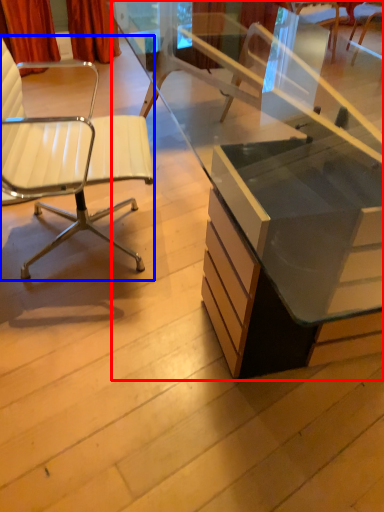
Question: Among these objects, which one is nearest to the camera, desk (highlighted by a red box) or chair (highlighted by a blue box)?

Choices:
 (A) desk
 (B) chair

Answer: (A)